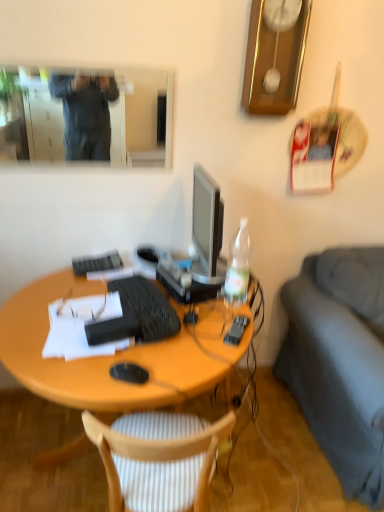
Find the location of a particular element. The width and height of the screenshot is (384, 512). free spot to the right of white paper at center is located at coordinates (176, 350).